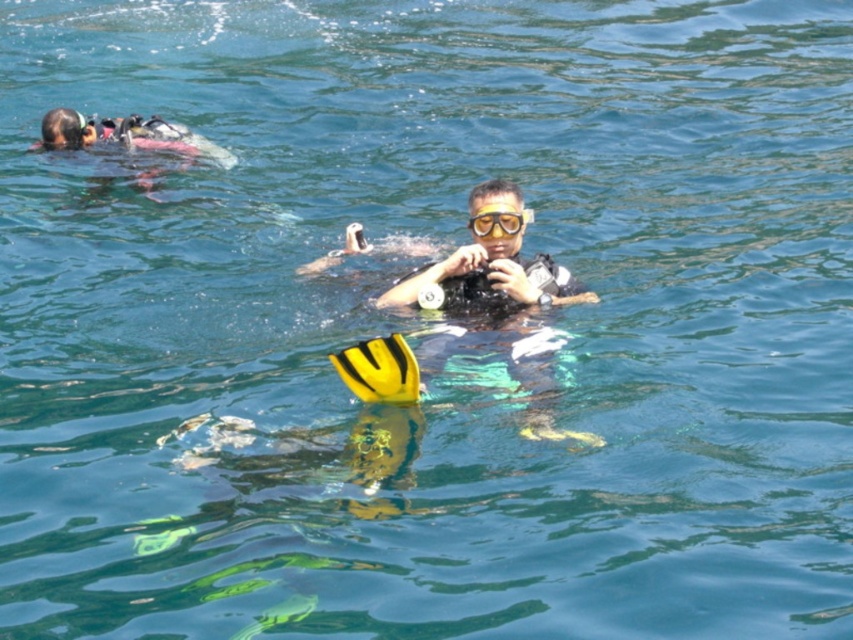
Who is lower down, matte black wetsuit at center or clear plastic goggles at center?

Positioned lower is matte black wetsuit at center.

The width and height of the screenshot is (853, 640). In order to click on matte black wetsuit at center in this screenshot , I will do `click(488, 266)`.

The image size is (853, 640). What are the coordinates of `matte black wetsuit at center` in the screenshot? It's located at (488, 266).